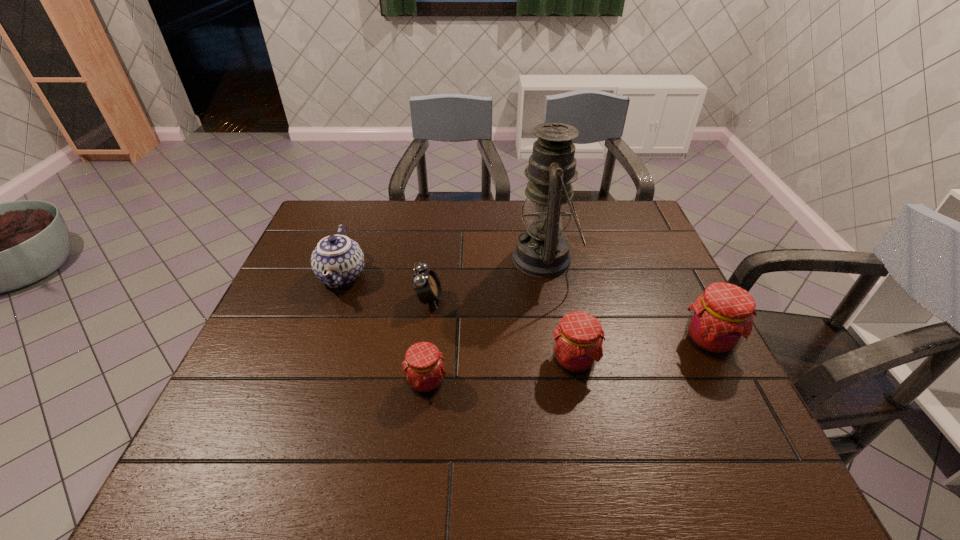
The image size is (960, 540). In order to click on vacant space located 0.160m on the front of the tallest jam in this screenshot , I will do `click(752, 426)`.

Where is `free space located on the front of the oil lamp`? This screenshot has height=540, width=960. free space located on the front of the oil lamp is located at coordinates (564, 367).

In order to click on vacant area situated 0.200m from the spout of the chinaware in this screenshot , I will do `click(310, 365)`.

The width and height of the screenshot is (960, 540). I want to click on vacant space located 0.390m on the face of the alarm clock, so click(x=586, y=299).

Identify the location of object that is at the far edge. The width and height of the screenshot is (960, 540). (542, 251).

This screenshot has height=540, width=960. In order to click on object that is at the near edge in this screenshot , I will do `click(423, 365)`.

You are a GUI agent. You are given a task and a screenshot of the screen. Output one action in this format:
    pyautogui.click(x=<x>, y=<y>)
    Task: Click on the object positioned at the left edge
    The height and width of the screenshot is (540, 960).
    Given the screenshot: What is the action you would take?
    pyautogui.click(x=337, y=261)

The height and width of the screenshot is (540, 960). What are the coordinates of `object located in the right edge section of the desktop` in the screenshot? It's located at pos(721,318).

Image resolution: width=960 pixels, height=540 pixels. Identify the location of vacant space at the far edge. (518, 201).

Where is `free region at the near edge`? This screenshot has width=960, height=540. free region at the near edge is located at coordinates (359, 423).